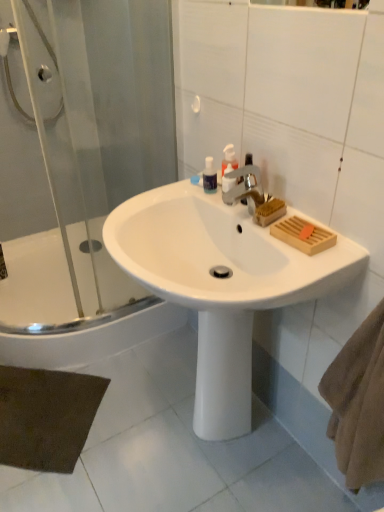
At what (x,y) coordinates should I click in order to perform the action: click on vacant area to the left of translucent plastic soap dispenser at upper center. Please return your answer as a coordinate pair (x, y). This screenshot has height=512, width=384. Looking at the image, I should click on (174, 197).